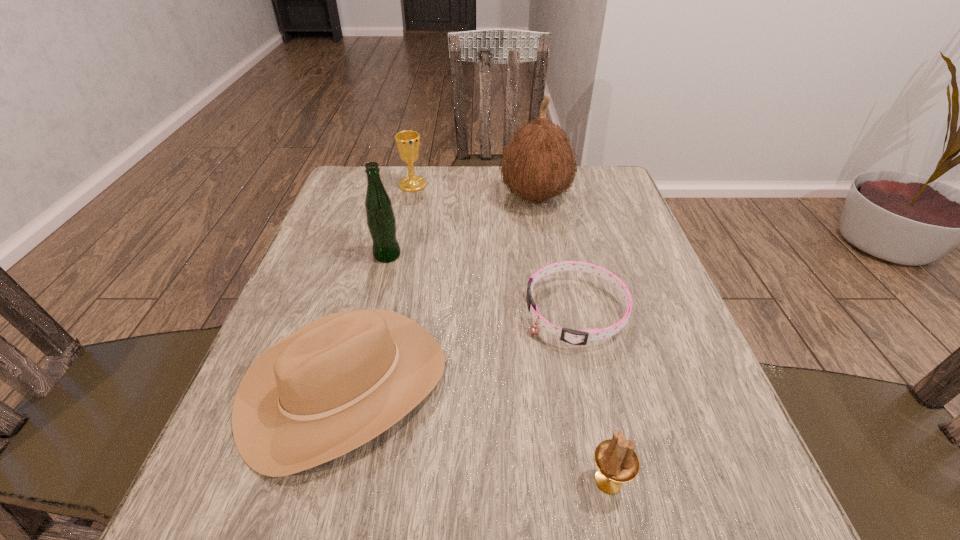
This screenshot has height=540, width=960. Identify the location of coconut. [x=538, y=163].

Where is `the second tallest object`? Image resolution: width=960 pixels, height=540 pixels. the second tallest object is located at coordinates (381, 221).

Locate an element on the screen. the third farthest object is located at coordinates (381, 221).

Image resolution: width=960 pixels, height=540 pixels. Identify the location of chalice. (407, 142).

At what (x,y) coordinates should I click in order to perform the action: click on candle holder. Please return your answer as a coordinate pair (x, y). This screenshot has height=540, width=960. Looking at the image, I should click on (616, 460).

Locate an element on the screen. Image resolution: width=960 pixels, height=540 pixels. cowboy hat is located at coordinates (338, 382).

Identify the location of the shortest object. (576, 337).

Where is `free space located 0.170m on the surface of the coconut`? The image size is (960, 540). free space located 0.170m on the surface of the coconut is located at coordinates coord(434,197).

Locate an element on the screen. free space located on the surface of the coconut is located at coordinates (360, 197).

I want to click on free space located 0.350m on the surface of the coconut, so click(368, 197).